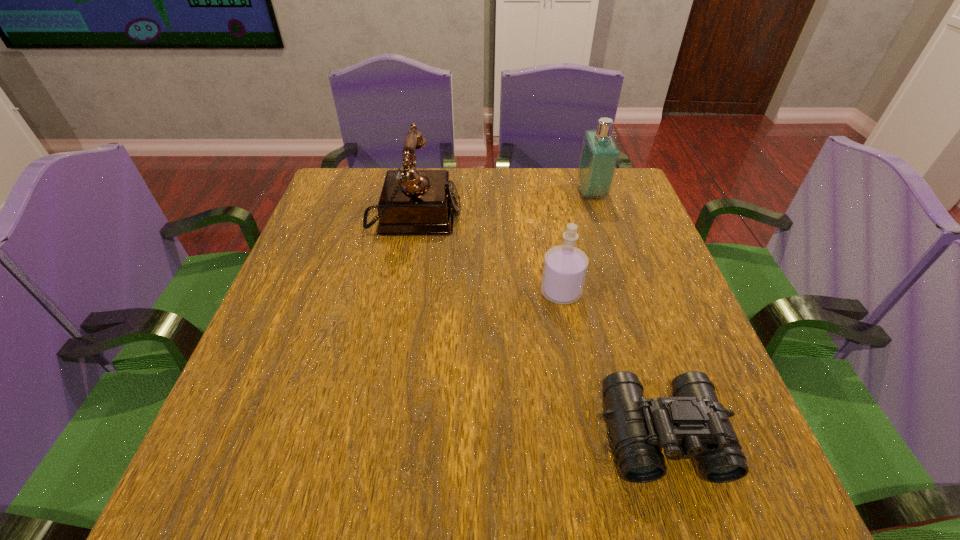
Find the location of a particular element. the farther perfume is located at coordinates (600, 153).

In order to click on the taller perfume in this screenshot , I will do `click(600, 153)`.

What are the coordinates of `the leftmost object` in the screenshot? It's located at (413, 202).

Find the location of a particular element. The height and width of the screenshot is (540, 960). the shorter perfume is located at coordinates (565, 266).

The image size is (960, 540). What are the coordinates of `the left perfume` in the screenshot? It's located at (565, 266).

This screenshot has width=960, height=540. Find the location of `binoculars`. binoculars is located at coordinates tap(692, 424).

The width and height of the screenshot is (960, 540). I want to click on the shortest object, so (x=692, y=424).

What are the coordinates of `blank space located 0.220m on the front label of the farther perfume` in the screenshot? It's located at (501, 193).

Locate an element on the screen. This screenshot has height=540, width=960. vacant region located on the front label of the farther perfume is located at coordinates (448, 193).

The image size is (960, 540). I want to click on free location located on the front label of the farther perfume, so click(463, 193).